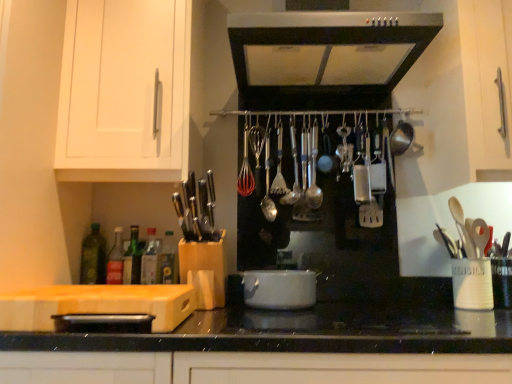
Question: Is green glass bottle at left, arranged as the fifth bottle when viewed from the right, next to green glass bottle at lower left, marked as the third bottle in a left-to-right arrangement, and touching it?

Choices:
 (A) no
 (B) yes

Answer: (A)

Question: Considering the relative sizes of green glass bottle at left, the 1th bottle positioned from the left, and green glass bottle at lower left, marked as the third bottle in a left-to-right arrangement, in the image provided, is green glass bottle at left, the 1th bottle positioned from the left, shorter than green glass bottle at lower left, marked as the third bottle in a left-to-right arrangement,?

Choices:
 (A) no
 (B) yes

Answer: (A)

Question: Can you confirm if green glass bottle at left, the 1th bottle positioned from the left, is positioned to the left of green glass bottle at lower left, marked as the 3th bottle in a right-to-left arrangement?

Choices:
 (A) yes
 (B) no

Answer: (A)

Question: From the image's perspective, would you say green glass bottle at left, the 1th bottle positioned from the left, is shown under green glass bottle at lower left, marked as the 3th bottle in a right-to-left arrangement?

Choices:
 (A) yes
 (B) no

Answer: (B)

Question: Does green glass bottle at left, the 1th bottle positioned from the left, turn towards green glass bottle at lower left, marked as the third bottle in a left-to-right arrangement?

Choices:
 (A) yes
 (B) no

Answer: (B)

Question: From the image's perspective, is white glossy pot at center positioned above or below satin silver range hood at upper center?

Choices:
 (A) below
 (B) above

Answer: (A)

Question: Is white glossy pot at center taller or shorter than satin silver range hood at upper center?

Choices:
 (A) short
 (B) tall

Answer: (A)

Question: From a real-world perspective, is white glossy pot at center above or below satin silver range hood at upper center?

Choices:
 (A) above
 (B) below

Answer: (B)

Question: Is white glossy pot at center inside the boundaries of satin silver range hood at upper center, or outside?

Choices:
 (A) inside
 (B) outside

Answer: (B)

Question: From their relative heights in the image, would you say green glass bottle at left, the 1th bottle positioned from the left, is taller or shorter than white glossy pot at center?

Choices:
 (A) short
 (B) tall

Answer: (B)

Question: From the image's perspective, is green glass bottle at left, the 1th bottle positioned from the left, positioned above or below white glossy pot at center?

Choices:
 (A) below
 (B) above

Answer: (B)

Question: Relative to white glossy pot at center, is green glass bottle at left, the 1th bottle positioned from the left, in front or behind?

Choices:
 (A) behind
 (B) front

Answer: (A)

Question: Based on their sizes in the image, would you say green glass bottle at left, the 1th bottle positioned from the left, is bigger or smaller than white glossy pot at center?

Choices:
 (A) big
 (B) small

Answer: (B)

Question: In the image, is satin silver spoon at center, which appears as the 3th utensil when viewed from the left, positioned in front of or behind green glass bottle at left, arranged as the fifth bottle when viewed from the right?

Choices:
 (A) behind
 (B) front

Answer: (A)

Question: From the image's perspective, is satin silver spoon at center, which appears as the 3th utensil when viewed from the left, above or below green glass bottle at left, the 1th bottle positioned from the left?

Choices:
 (A) above
 (B) below

Answer: (A)